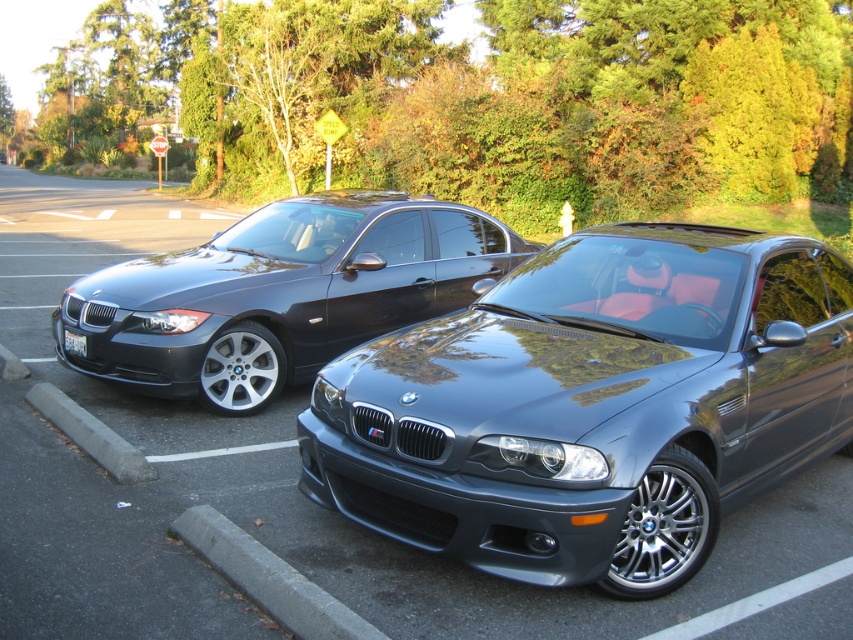
Question: Considering the real-world distances, which object is closest to the satin black sedan at left?

Choices:
 (A) gray concrete curb at lower center
 (B) white plastic license plate at lower left

Answer: (B)

Question: Which object is positioned closest to the satin metallic car at center?

Choices:
 (A) gray concrete curb at lower center
 (B) white plastic license plate at lower left

Answer: (A)

Question: Does satin metallic car at center have a greater width compared to white plastic license plate at lower left?

Choices:
 (A) yes
 (B) no

Answer: (A)

Question: Is satin metallic car at center to the left of white plastic license plate at lower left from the viewer's perspective?

Choices:
 (A) no
 (B) yes

Answer: (A)

Question: Which object appears closest to the camera in this image?

Choices:
 (A) satin metallic car at center
 (B) white plastic license plate at lower left
 (C) gray concrete curb at lower center

Answer: (C)

Question: Does satin metallic car at center have a smaller size compared to white plastic license plate at lower left?

Choices:
 (A) yes
 (B) no

Answer: (B)